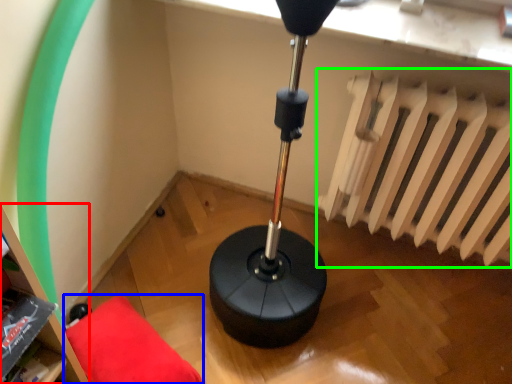
Question: Considering the real-world distances, which object is farthest from bookshelf (highlighted by a red box)? furniture (highlighted by a blue box) or radiator (highlighted by a green box)?

Choices:
 (A) furniture
 (B) radiator

Answer: (B)